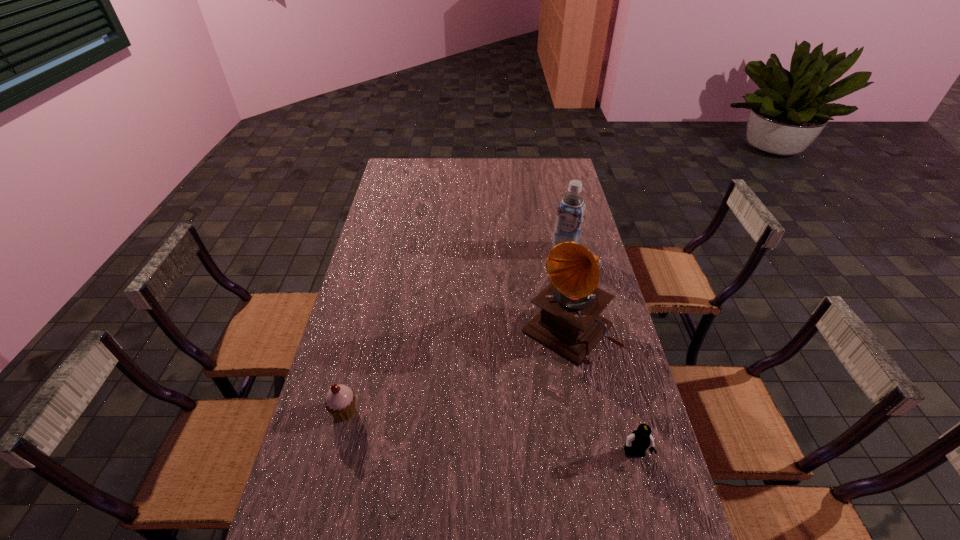
Where is `vacant spot on the desktop that is between the cupcake and the nearest object and is positioned on the label of the soya milk`? The width and height of the screenshot is (960, 540). vacant spot on the desktop that is between the cupcake and the nearest object and is positioned on the label of the soya milk is located at coordinates (471, 430).

Where is `free space on the desktop that is between the cupcake and the Lego and is positioned on the horn of the tallest object`? The width and height of the screenshot is (960, 540). free space on the desktop that is between the cupcake and the Lego and is positioned on the horn of the tallest object is located at coordinates [x=474, y=430].